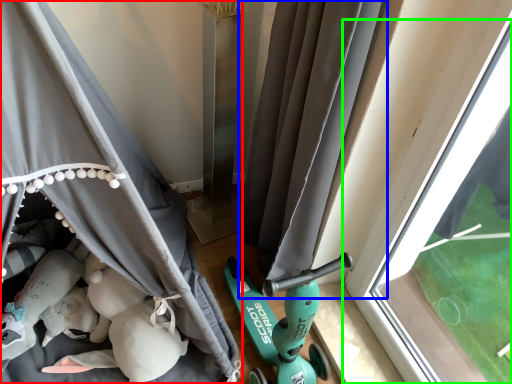
Question: Based on their relative distances, which object is nearer to curtain (highlighted by a red box)? Choose from curtain (highlighted by a blue box) and window (highlighted by a green box).

Choices:
 (A) curtain
 (B) window

Answer: (A)